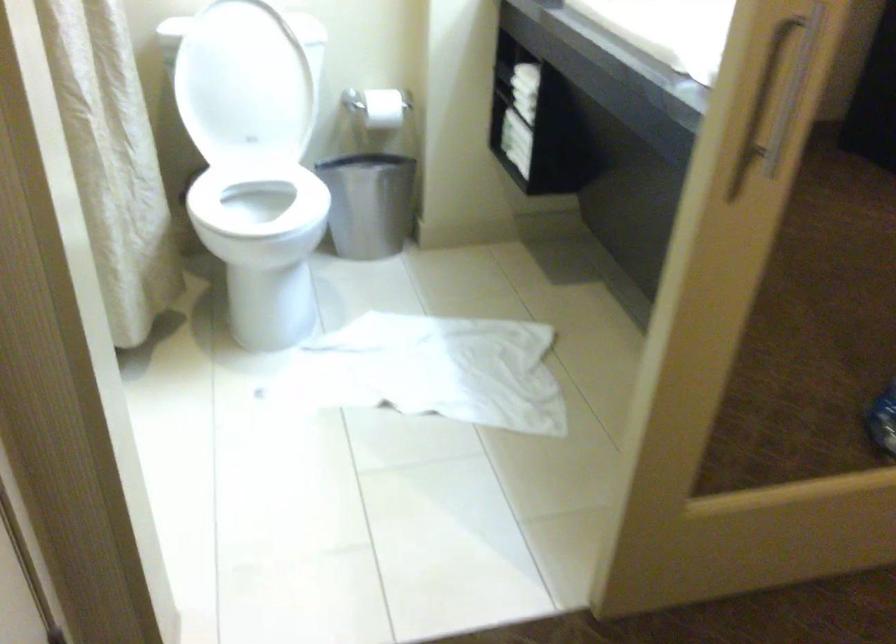
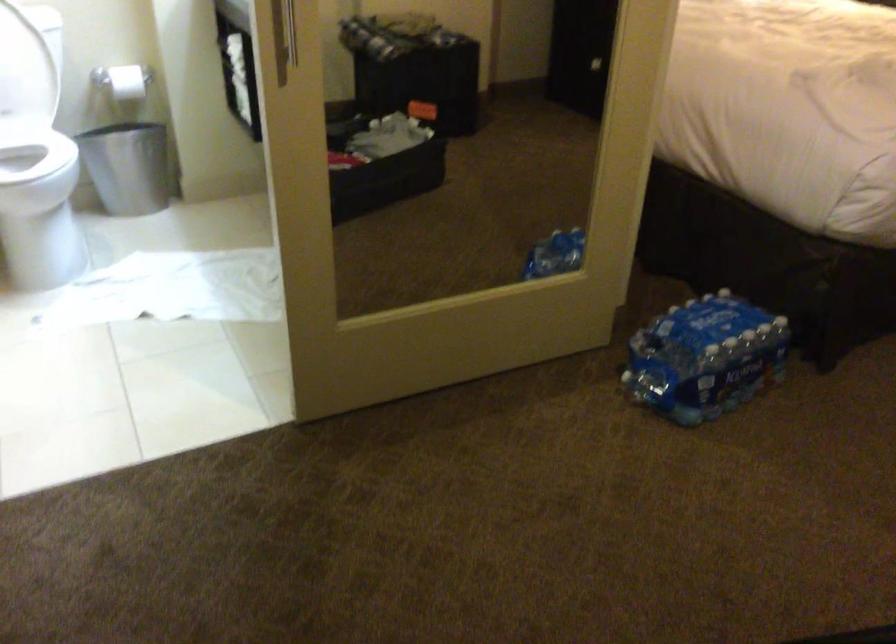
Question: The camera is either moving clockwise (left) or counter-clockwise (right) around the object. The first image is from the beginning of the video and the second image is from the end. Is the camera moving left or right when shooting the video?

Choices:
 (A) Left
 (B) Right

Answer: (A)